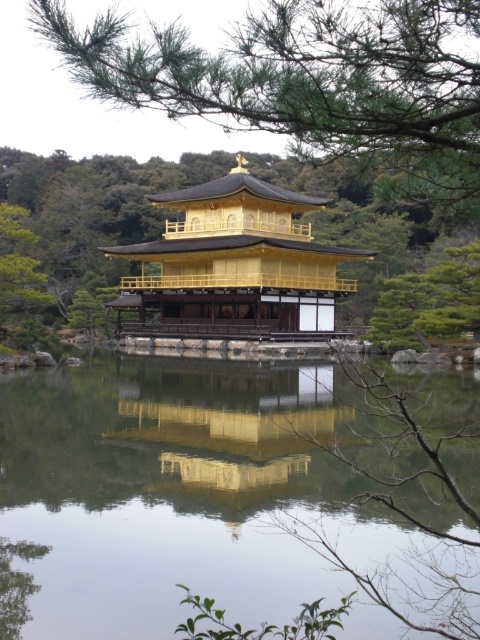
Question: Which of the following is the closest to the observer?

Choices:
 (A) (13, 250)
 (B) (336, 51)
 (C) (180, 483)
 (D) (169, 336)

Answer: (B)

Question: Is transparent glass lake at center positioned behind gold lacquered pagoda at center?

Choices:
 (A) no
 (B) yes

Answer: (A)

Question: Which point is farther to the camera?

Choices:
 (A) green leafy tree at left
 (B) transparent glass lake at center
 (C) gold lacquered pagoda at center
 (D) gold reflective surface at center

Answer: (C)

Question: Is transparent glass lake at center above green leafy branch at upper center?

Choices:
 (A) yes
 (B) no

Answer: (B)

Question: Which of these objects is positioned farthest from the transparent glass lake at center?

Choices:
 (A) gold lacquered pagoda at center
 (B) green leafy branch at upper center
 (C) gold reflective surface at center

Answer: (A)

Question: Does transparent glass lake at center come behind green leafy branch at upper center?

Choices:
 (A) no
 (B) yes

Answer: (B)